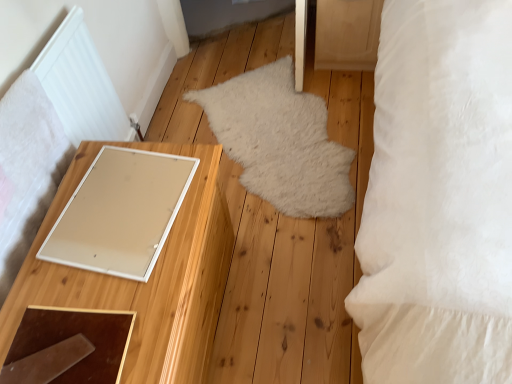
Question: Is white fluffy rug at center not near white matte mirror at left?

Choices:
 (A) no
 (B) yes

Answer: (A)

Question: Is white fluffy rug at center further to the viewer compared to white matte mirror at left?

Choices:
 (A) yes
 (B) no

Answer: (A)

Question: Are white fluffy rug at center and white matte mirror at left making contact?

Choices:
 (A) no
 (B) yes

Answer: (A)

Question: Does white fluffy rug at center have a lesser height compared to white matte mirror at left?

Choices:
 (A) no
 (B) yes

Answer: (B)

Question: Does white fluffy rug at center have a greater height compared to white matte mirror at left?

Choices:
 (A) no
 (B) yes

Answer: (A)

Question: Is white matte mirror at left at the back of white fluffy rug at center?

Choices:
 (A) no
 (B) yes

Answer: (A)

Question: From a real-world perspective, is wooden drawer at upper right physically below white soft pillow at right?

Choices:
 (A) no
 (B) yes

Answer: (B)

Question: Considering the relative sizes of wooden drawer at upper right and white soft pillow at right in the image provided, is wooden drawer at upper right wider than white soft pillow at right?

Choices:
 (A) yes
 (B) no

Answer: (B)

Question: Is wooden drawer at upper right at the right side of white soft pillow at right?

Choices:
 (A) no
 (B) yes

Answer: (A)

Question: Is wooden drawer at upper right bigger than white soft pillow at right?

Choices:
 (A) no
 (B) yes

Answer: (A)

Question: Is wooden drawer at upper right positioned with its back to white soft pillow at right?

Choices:
 (A) no
 (B) yes

Answer: (A)

Question: Is wooden drawer at upper right to the left of white soft pillow at right from the viewer's perspective?

Choices:
 (A) no
 (B) yes

Answer: (B)

Question: Does white soft pillow at right appear on the right side of white fluffy rug at center?

Choices:
 (A) no
 (B) yes

Answer: (B)